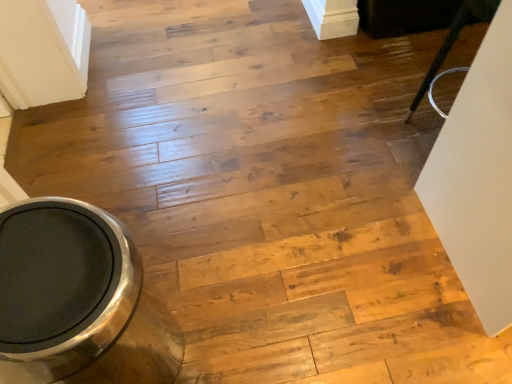
Locate an element on the screen. vacant area to the left of black glossy chair at upper right is located at coordinates (375, 139).